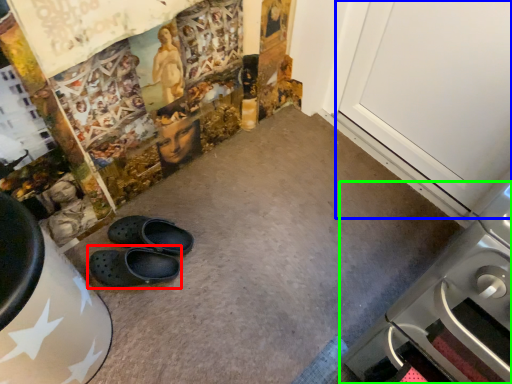
Question: Based on their relative distances, which object is nearer to footwear (highlighted by a red box)? Choose from door (highlighted by a blue box) and home appliance (highlighted by a green box).

Choices:
 (A) door
 (B) home appliance

Answer: (B)